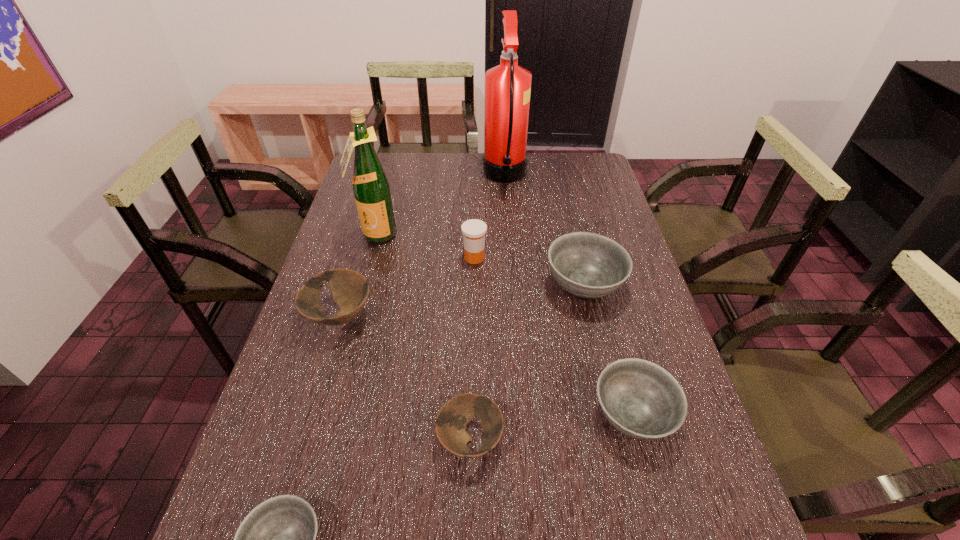
At what (x,y) coordinates should I click in order to perform the action: click on free space that satisfies the following two spatial constraints: 1. on the label of the farthest gray bowl; 2. on the left side of the orange medicine. Please return your answer as a coordinate pair (x, y). This screenshot has height=540, width=960. Looking at the image, I should click on (474, 285).

Locate an element on the screen. Image resolution: width=960 pixels, height=540 pixels. vacant area in the image that satisfies the following two spatial constraints: 1. at the spray nozzle of the tallest object; 2. on the front-facing side of the liquor is located at coordinates coord(509,235).

Locate an element on the screen. Image resolution: width=960 pixels, height=540 pixels. free region that satisfies the following two spatial constraints: 1. at the spray nozzle of the farthest object; 2. on the back side of the second farthest gray bowl is located at coordinates (523, 416).

At what (x,y) coordinates should I click in order to perform the action: click on vacant region that satisfies the following two spatial constraints: 1. on the label of the second biggest gray bowl; 2. on the right side of the orange medicine. Please return your answer as a coordinate pair (x, y). The width and height of the screenshot is (960, 540). Looking at the image, I should click on (472, 416).